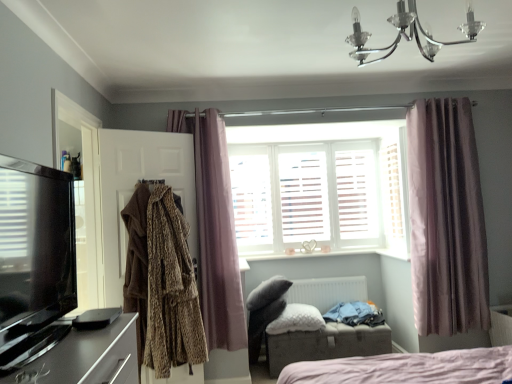
Locate an element on the screen. The height and width of the screenshot is (384, 512). empty space that is ontop of white matte radiator at center (from a real-world perspective) is located at coordinates (323, 279).